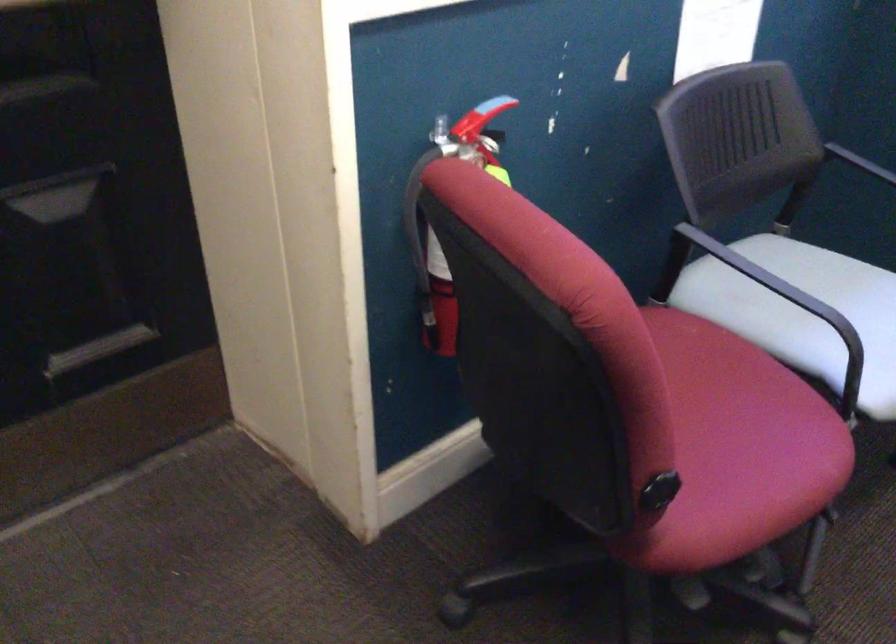
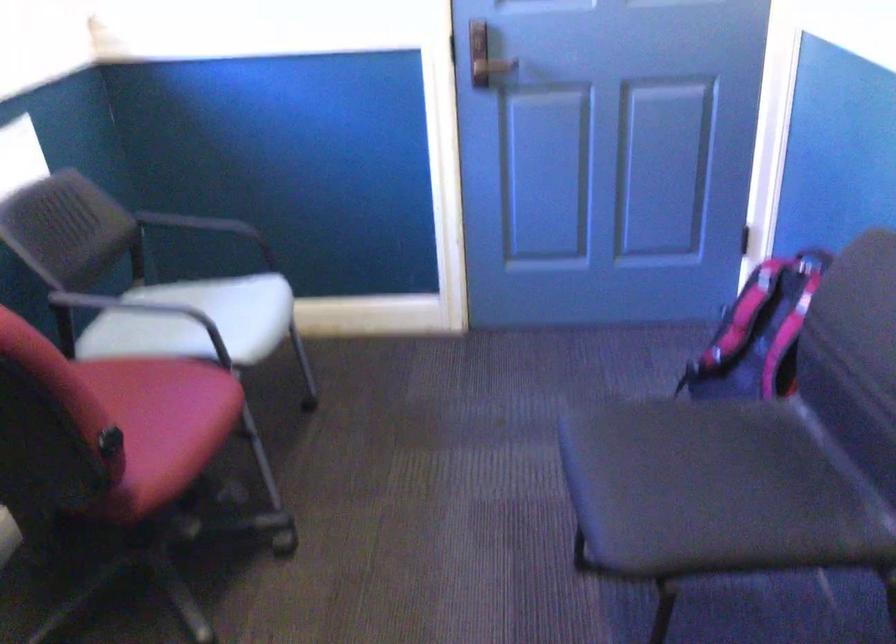
The point at (642, 500) is marked in the first image. Where is the corresponding point in the second image?

(109, 442)